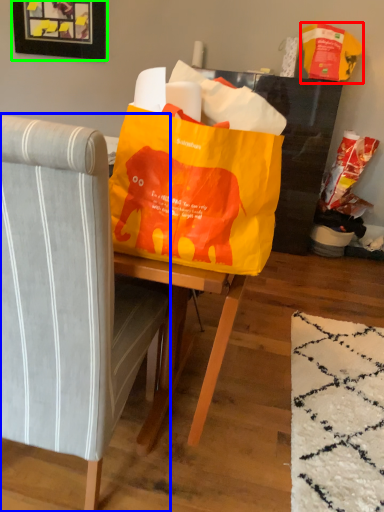
Question: Which object is positioned closest to grocery bag (highlighted by a red box)? Select from chair (highlighted by a blue box) and picture frame (highlighted by a green box).

Choices:
 (A) chair
 (B) picture frame

Answer: (B)